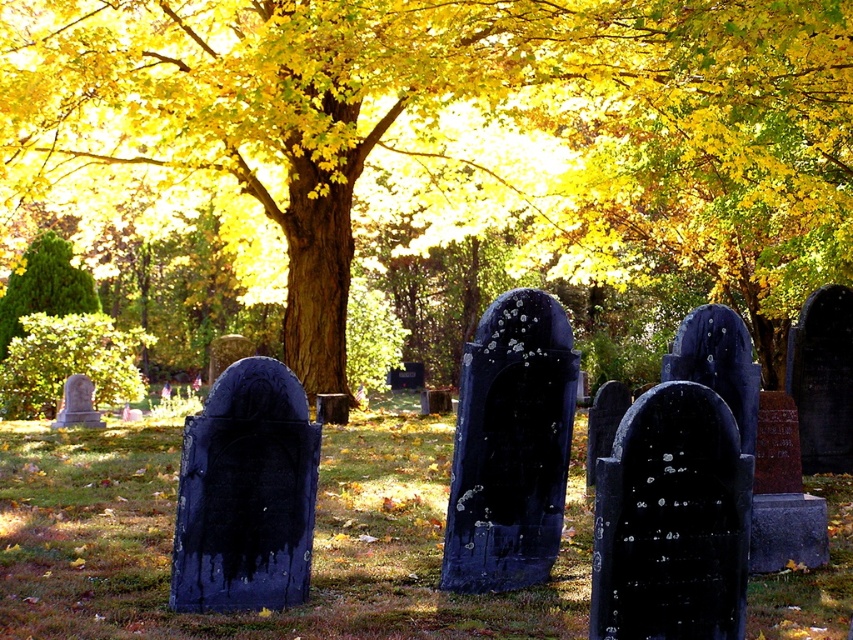
Question: Is golden textured tree at center above smooth gray stone at lower left?

Choices:
 (A) yes
 (B) no

Answer: (A)

Question: Does golden textured tree at center have a lesser width compared to smooth gray stone at lower left?

Choices:
 (A) yes
 (B) no

Answer: (B)

Question: Which is nearer to the green textured bush at left?

Choices:
 (A) smooth gray stone at lower left
 (B) golden textured tree at center

Answer: (A)

Question: Among these points, which one is farthest from the camera?

Choices:
 (A) (68, 412)
 (B) (16, 280)
 (C) (328, 284)

Answer: (B)

Question: Which object appears closest to the camera in this image?

Choices:
 (A) green textured bush at left
 (B) smooth gray stone at lower left
 (C) golden textured tree at center

Answer: (C)

Question: Can you confirm if golden textured tree at center is smaller than green textured bush at left?

Choices:
 (A) no
 (B) yes

Answer: (A)